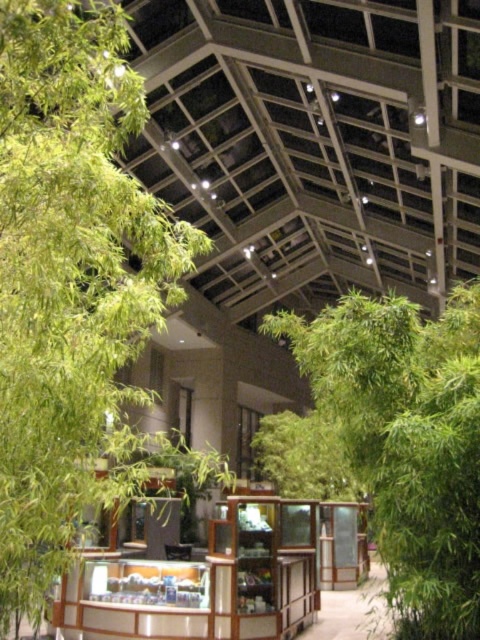
Is green leafy tree at left thinner than wooden display case at center?

Correct, green leafy tree at left's width is less than wooden display case at center's.

Who is more distant from viewer, (31, 330) or (98, 604)?

Positioned behind is point (98, 604).

Is point (140, 394) closer to camera compared to point (106, 609)?

Yes, it is in front of point (106, 609).

You are a GUI agent. You are given a task and a screenshot of the screen. Output one action in this format:
    pyautogui.click(x=<x>, y=<y>)
    Task: Click on the green leafy tree at left
    The width and height of the screenshot is (480, 640).
    Given the screenshot: What is the action you would take?
    pyautogui.click(x=71, y=280)

Does green leafy bamboo at right appear on the right side of wooden display case at center?

Correct, you'll find green leafy bamboo at right to the right of wooden display case at center.

Which of these two, green leafy bamboo at right or wooden display case at center, stands taller?

green leafy bamboo at right

In order to click on green leafy bamboo at right in this screenshot , I will do `click(400, 440)`.

The image size is (480, 640). Identify the location of green leafy bamboo at right. (400, 440).

Is green leafy tree at left further to camera compared to green leafy bamboo at right?

No, green leafy tree at left is in front of green leafy bamboo at right.

Between green leafy tree at left and green leafy bamboo at right, which one appears on the left side from the viewer's perspective?

Positioned to the left is green leafy tree at left.

Who is more distant from viewer, (123, 467) or (320, 372)?

Positioned behind is point (320, 372).

You are a GUI agent. You are given a task and a screenshot of the screen. Output one action in this format:
    pyautogui.click(x=<x>, y=<y>)
    Task: Click on the green leafy tree at left
    
    Given the screenshot: What is the action you would take?
    pyautogui.click(x=71, y=280)